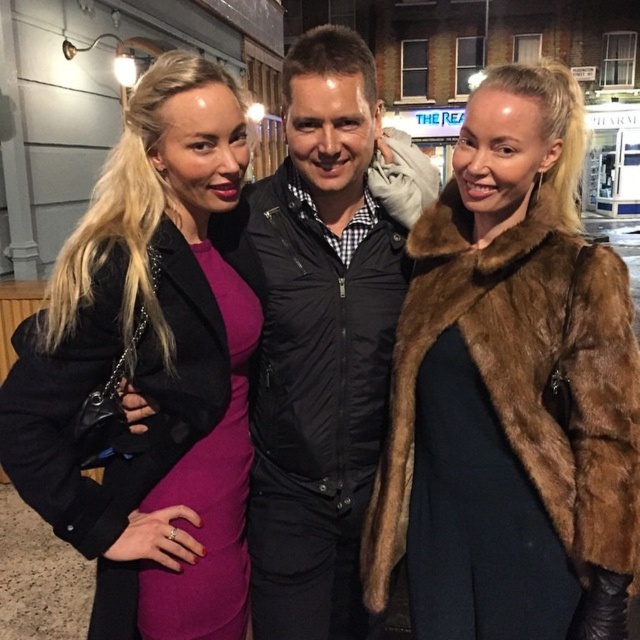
Question: Which of the following is the closest to the observer?

Choices:
 (A) matte black coat at left
 (B) brown fur coat at right

Answer: (B)

Question: Does matte black coat at left have a smaller size compared to brown fur coat at right?

Choices:
 (A) no
 (B) yes

Answer: (A)

Question: Does matte black coat at left have a lesser width compared to brown fur coat at right?

Choices:
 (A) yes
 (B) no

Answer: (A)

Question: Is matte black coat at left further to camera compared to brown fur coat at right?

Choices:
 (A) no
 (B) yes

Answer: (B)

Question: Which of the following is the closest to the observer?

Choices:
 (A) brown fur coat at right
 (B) black quilted jacket at center

Answer: (A)

Question: Which point is farther to the camera?

Choices:
 (A) (68, 509)
 (B) (296, 461)
 (C) (532, 392)

Answer: (B)